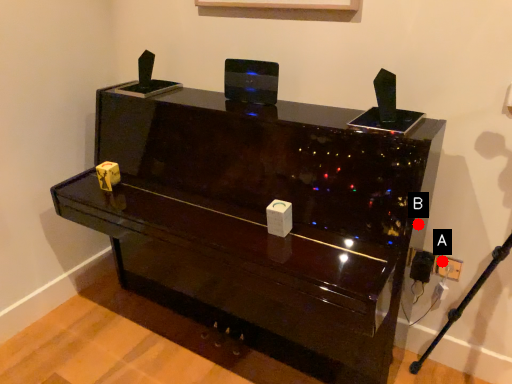
Question: Two points are circled on the image, labeled by A and B beside each circle. Which point is farther from the camera taking this photo?

Choices:
 (A) A is further
 (B) B is further

Answer: (A)